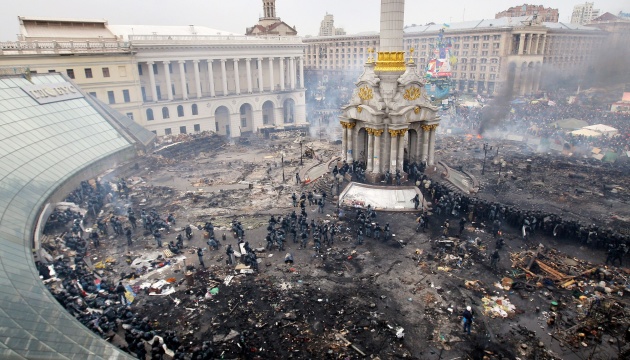
The image size is (630, 360). What are the coordinates of `empty space in center of roof post` in the screenshot? It's located at (392, 27).